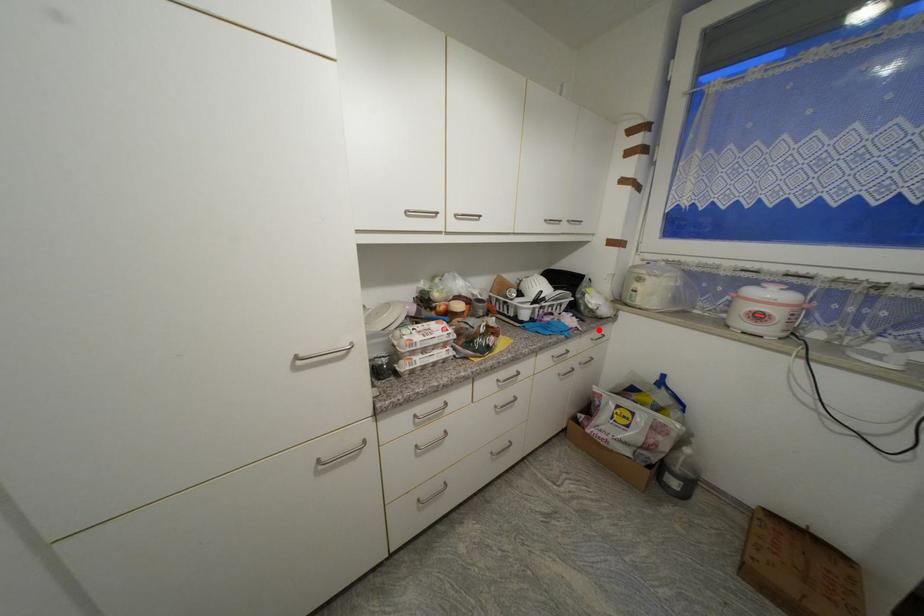
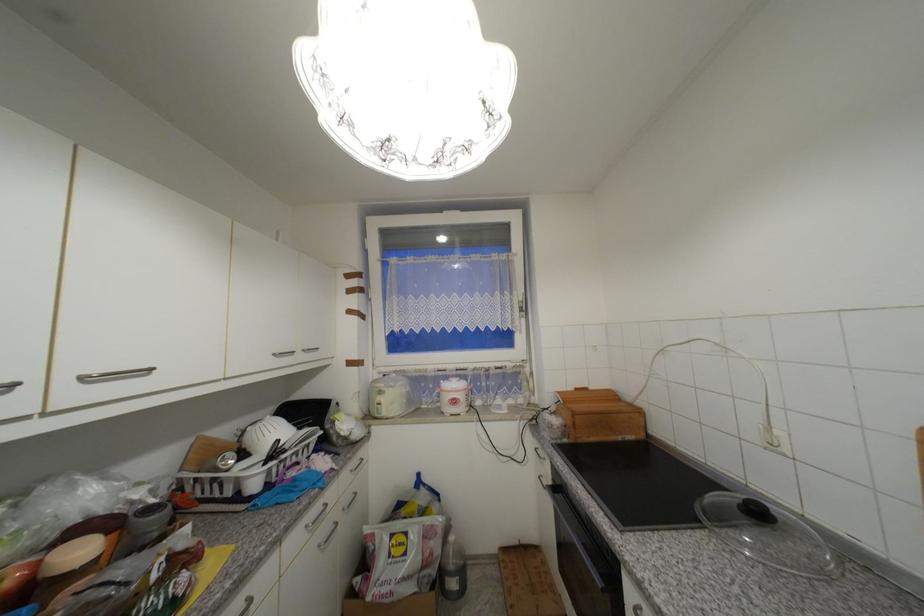
Find the pixel in the second image that matches the highlighted location in the first image.

(357, 460)